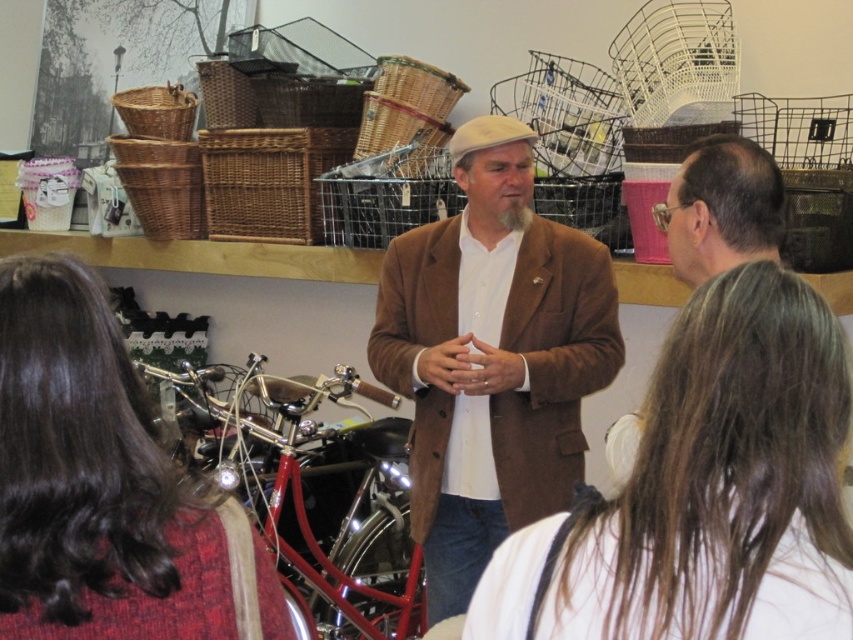
Between smooth brown hair at center and dark brown hair at center, which one has more height?

dark brown hair at center is taller.

Is smooth brown hair at center bigger than dark brown hair at center?

Correct, smooth brown hair at center is larger in size than dark brown hair at center.

Where is `smooth brown hair at center`? smooth brown hair at center is located at coordinates (724, 483).

Is smooth brown hair at center further to the viewer compared to shiny chrome motorcycle at center?

No, it is in front of shiny chrome motorcycle at center.

Is smooth brown hair at center wider than shiny chrome motorcycle at center?

No.

Does point (799, 296) come behind point (227, 368)?

That is False.

Image resolution: width=853 pixels, height=640 pixels. Find the location of `smooth brown hair at center`. smooth brown hair at center is located at coordinates (724, 483).

Who is shorter, brown woolen coat at center or dark brown hair at center?

Standing shorter between the two is dark brown hair at center.

Does brown woolen coat at center have a larger size compared to dark brown hair at center?

Correct, brown woolen coat at center is larger in size than dark brown hair at center.

What do you see at coordinates (491, 356) in the screenshot?
I see `brown woolen coat at center` at bounding box center [491, 356].

The height and width of the screenshot is (640, 853). Identify the location of brown woolen coat at center. (491, 356).